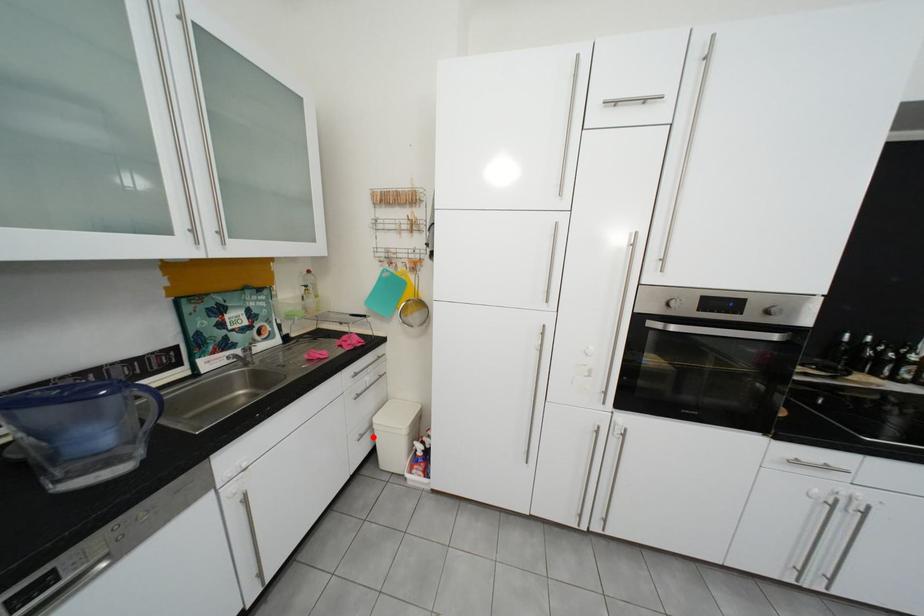
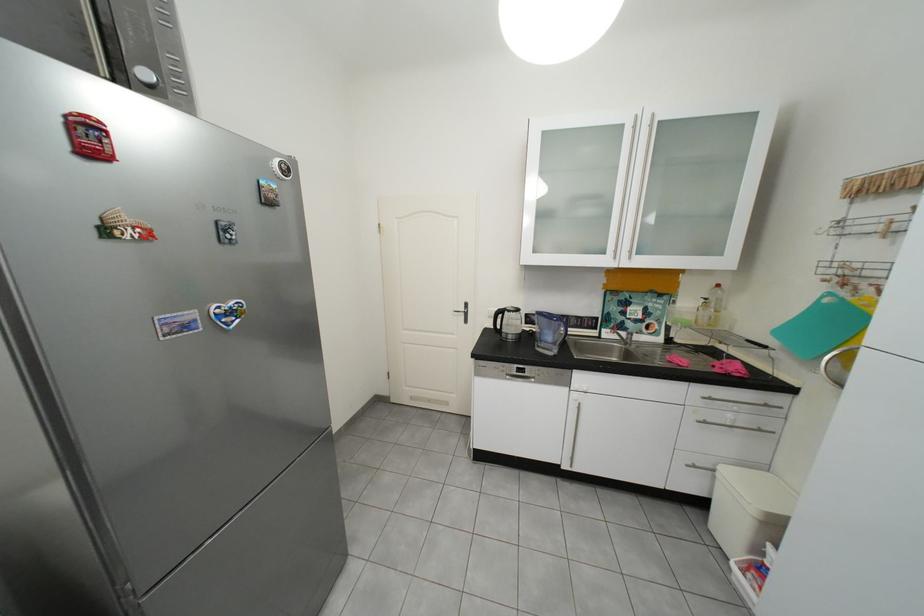
Question: A red point is marked in image1. In image2, is the corresponding 3D point closer to the camera or farther? Reply with the corresponding letter.

Choices:
 (A) The corresponding 3D point is closer.
 (B) The corresponding 3D point is farther.

Answer: (A)